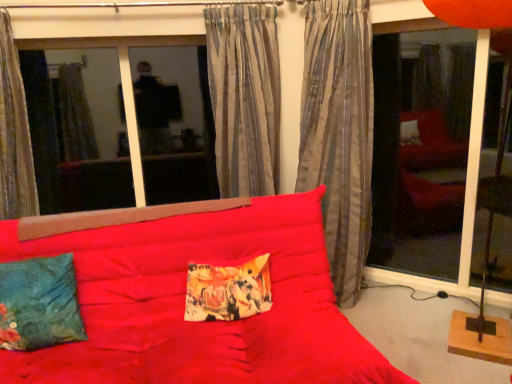
Question: Considering the positions of silky gray curtain at center, positioned as the 3th curtain in left-to-right order, and velvety teal pillow at lower left, the 2th pillow positioned from the right, in the image, is silky gray curtain at center, positioned as the 3th curtain in left-to-right order, bigger or smaller than velvety teal pillow at lower left, the 2th pillow positioned from the right,?

Choices:
 (A) big
 (B) small

Answer: (A)

Question: Do you think silky gray curtain at center, positioned as the 3th curtain in left-to-right order, is within velvety teal pillow at lower left, which appears as the first pillow when viewed from the left, or outside of it?

Choices:
 (A) outside
 (B) inside

Answer: (A)

Question: Estimate the real-world distances between objects in this image. Which object is closer to the printed fabric pillow at center, acting as the 1th pillow starting from the right?

Choices:
 (A) transparent glass door at right
 (B) silky gray curtain at center, positioned as the first curtain in right-to-left order
 (C) transparent glass window at upper left
 (D) striped fabric curtain at center, which is counted as the 2th curtain, starting from the left
 (E) striped fabric curtain at left, which appears as the 3th curtain when viewed from the right

Answer: (D)

Question: Estimate the real-world distances between objects in this image. Which object is closer to the silky gray curtain at center, positioned as the 3th curtain in left-to-right order?

Choices:
 (A) transparent glass door at right
 (B) striped fabric curtain at center, the second curtain from the right
 (C) transparent glass window at upper left
 (D) matte red studio couch at center
 (E) printed fabric pillow at center, acting as the 1th pillow starting from the right

Answer: (B)